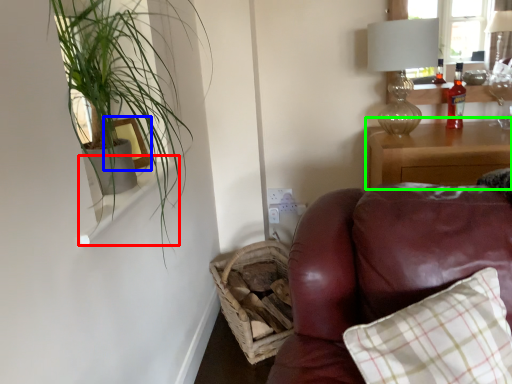
Question: Which object is positioned closest to window sill (highlighted by a red box)? Select from picture frame (highlighted by a blue box) and nightstand (highlighted by a green box).

Choices:
 (A) picture frame
 (B) nightstand

Answer: (A)